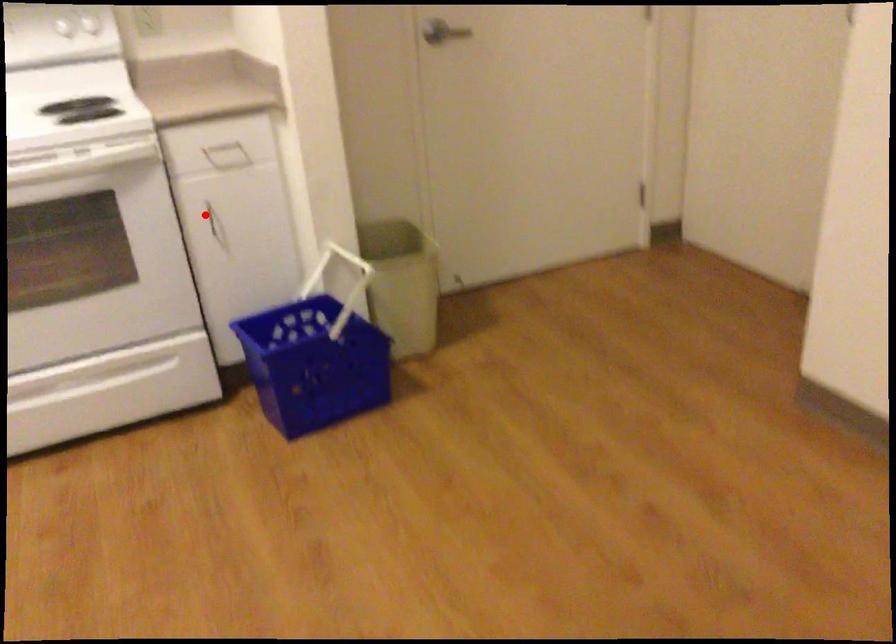
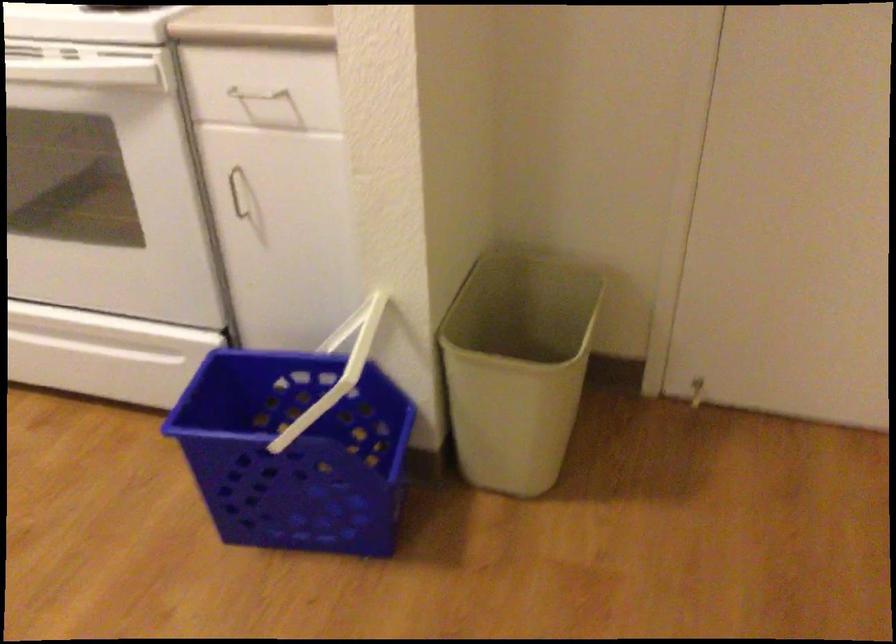
Find the pixel in the second image that matches the highlighted location in the first image.

(237, 192)